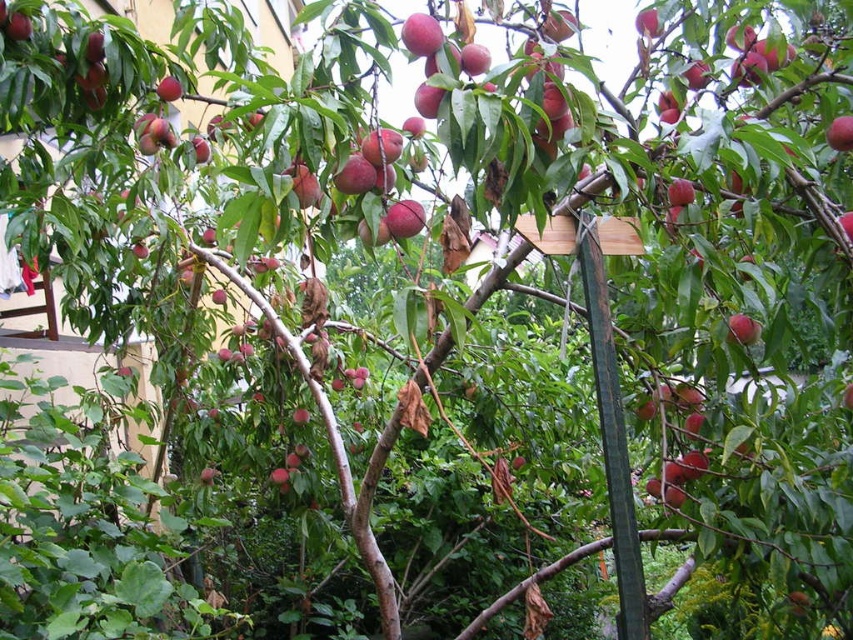
Question: Can you confirm if smooth red peach at center is thinner than matte red peach at upper left?

Choices:
 (A) yes
 (B) no

Answer: (A)

Question: Is green wood pole at center below matte red peach at upper left?

Choices:
 (A) no
 (B) yes

Answer: (B)

Question: Which of these objects is positioned closest to the red matte peach at upper right?

Choices:
 (A) smooth red peach at center
 (B) green wood pole at center

Answer: (A)

Question: Considering the real-world distances, which object is closest to the matte red peach at upper left?

Choices:
 (A) red matte peach at upper right
 (B) smooth red peach at center

Answer: (B)

Question: Does green wood pole at center appear under matte red peach at upper left?

Choices:
 (A) yes
 (B) no

Answer: (A)

Question: Which point appears farthest from the camera in this image?

Choices:
 (A) (741, 320)
 (B) (619, 428)
 (C) (838, 125)

Answer: (A)